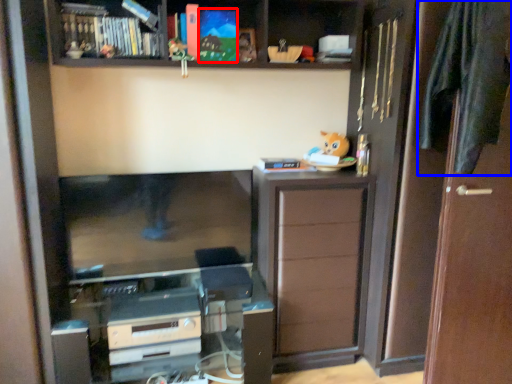
Question: Which point is closer to the camera, book (highlighted by a red box) or clothe (highlighted by a blue box)?

Choices:
 (A) book
 (B) clothe

Answer: (B)